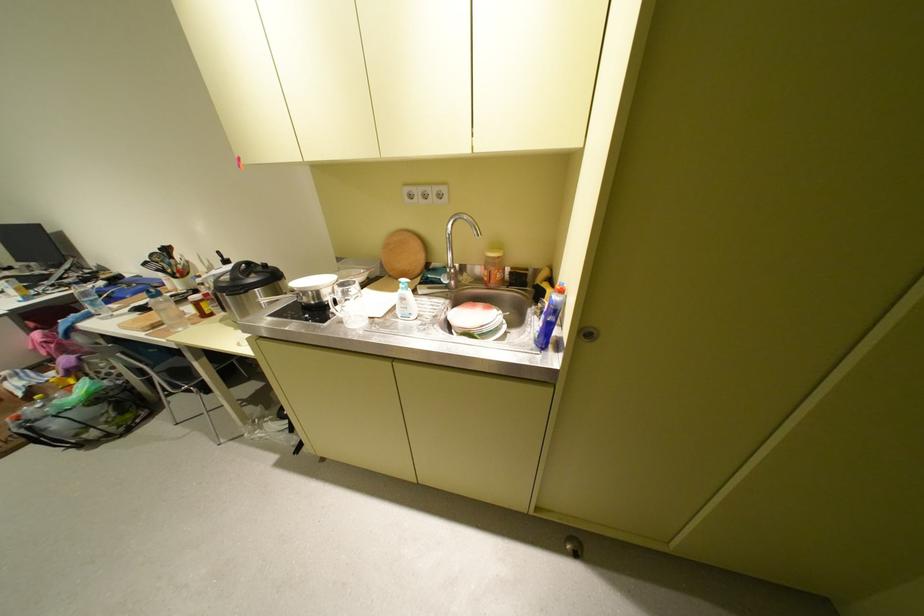
This screenshot has height=616, width=924. Identify the location of black pot handle. (242, 270).